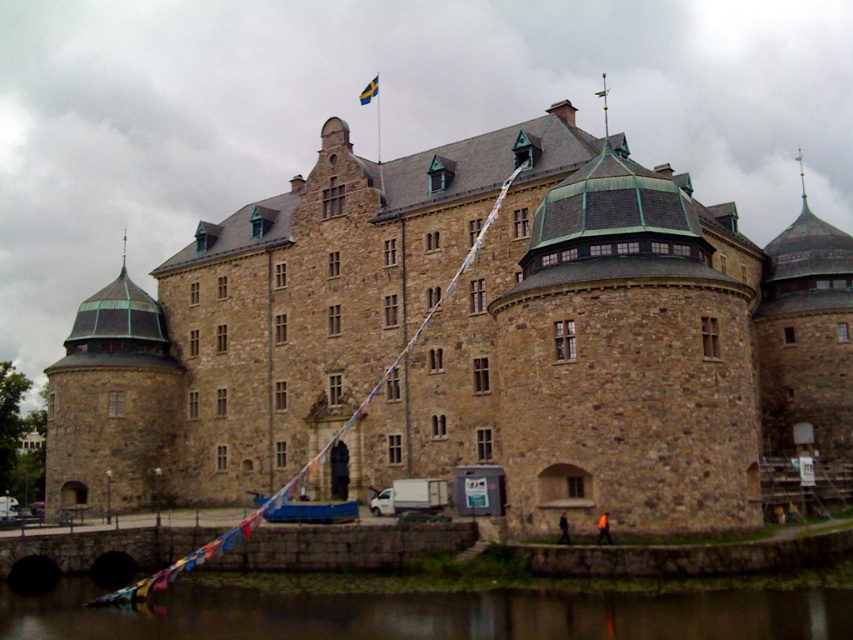
You are standing in front of the historic stone building and want to determine the position of two points marked on the flags. Which point, point (495, 147) or point (540, 621), is closer to you?

Point (495, 147) is closer to you because it is further to the viewer than point (540, 621).